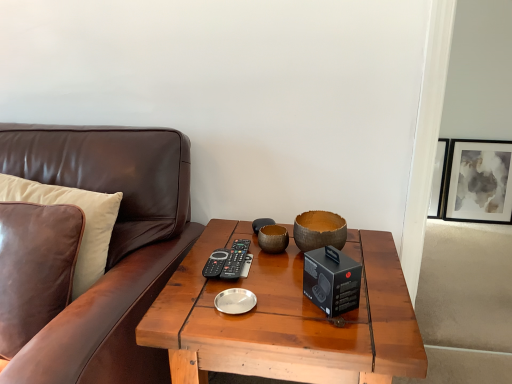
Question: From a real-world perspective, is natural wood bowl at center physically below wooden coffee table at center?

Choices:
 (A) yes
 (B) no

Answer: (B)

Question: Can you confirm if natural wood bowl at center is bigger than wooden coffee table at center?

Choices:
 (A) no
 (B) yes

Answer: (A)

Question: From the image's perspective, is natural wood bowl at center located beneath wooden coffee table at center?

Choices:
 (A) yes
 (B) no

Answer: (B)

Question: From the image's perspective, is natural wood bowl at center over wooden coffee table at center?

Choices:
 (A) no
 (B) yes

Answer: (B)

Question: Is natural wood bowl at center thinner than wooden coffee table at center?

Choices:
 (A) no
 (B) yes

Answer: (B)

Question: Is natural wood bowl at center further to the viewer compared to wooden coffee table at center?

Choices:
 (A) no
 (B) yes

Answer: (B)

Question: From the image's perspective, is leather pillow at left over natural wood bowl at center?

Choices:
 (A) yes
 (B) no

Answer: (B)

Question: Does leather pillow at left appear on the right side of natural wood bowl at center?

Choices:
 (A) no
 (B) yes

Answer: (A)

Question: Is leather pillow at left next to natural wood bowl at center?

Choices:
 (A) no
 (B) yes

Answer: (A)

Question: From the image's perspective, would you say leather pillow at left is shown under natural wood bowl at center?

Choices:
 (A) no
 (B) yes

Answer: (B)

Question: Does leather pillow at left turn towards natural wood bowl at center?

Choices:
 (A) no
 (B) yes

Answer: (A)

Question: Considering the relative sizes of leather pillow at left and natural wood bowl at center in the image provided, is leather pillow at left bigger than natural wood bowl at center?

Choices:
 (A) no
 (B) yes

Answer: (B)

Question: Does matte black picture frame at upper right have a larger size compared to brown leather couch at left?

Choices:
 (A) no
 (B) yes

Answer: (A)